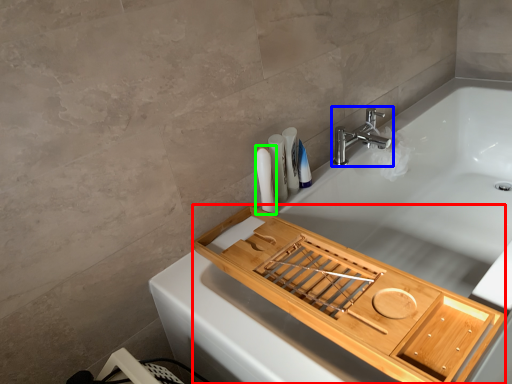
Question: Which is farther away from tray (highlighted by a red box)? tap (highlighted by a blue box) or toiletry (highlighted by a green box)?

Choices:
 (A) tap
 (B) toiletry

Answer: (A)